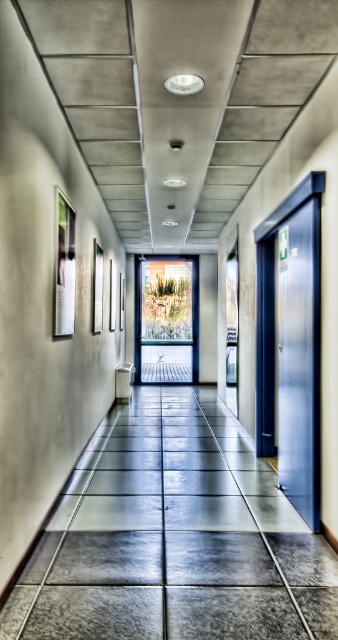
Question: Does gray tile floor at center appear over metallic blue door at right?

Choices:
 (A) yes
 (B) no

Answer: (B)

Question: Which object appears closest to the camera in this image?

Choices:
 (A) gray tile floor at center
 (B) metallic blue door at right

Answer: (B)

Question: Which of the following is the closest to the observer?

Choices:
 (A) (293, 358)
 (B) (36, 609)

Answer: (B)

Question: Can you confirm if gray tile floor at center is smaller than metallic blue door at right?

Choices:
 (A) yes
 (B) no

Answer: (A)

Question: Can you confirm if gray tile floor at center is positioned below metallic blue door at right?

Choices:
 (A) yes
 (B) no

Answer: (A)